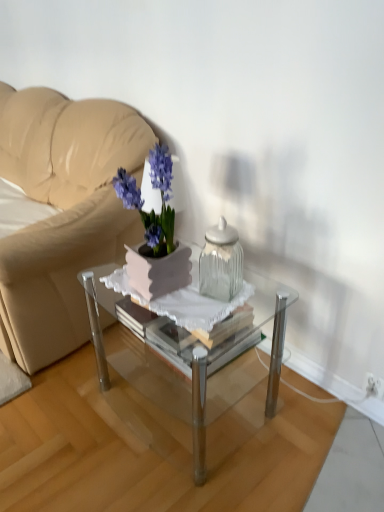
Find the location of a particular element. This screenshot has width=384, height=512. vacant space underneath clear glass coffee table at center (from a real-world perspective) is located at coordinates (187, 403).